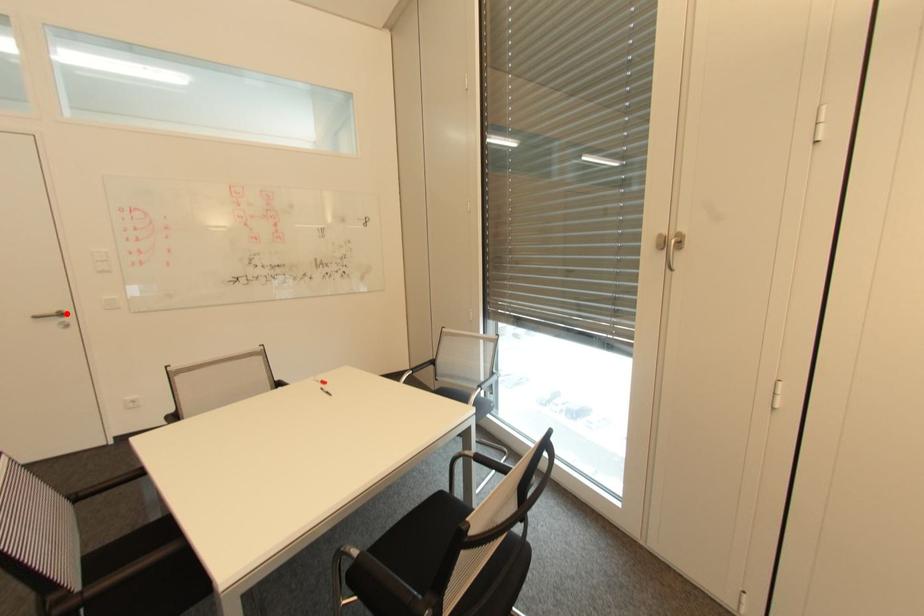
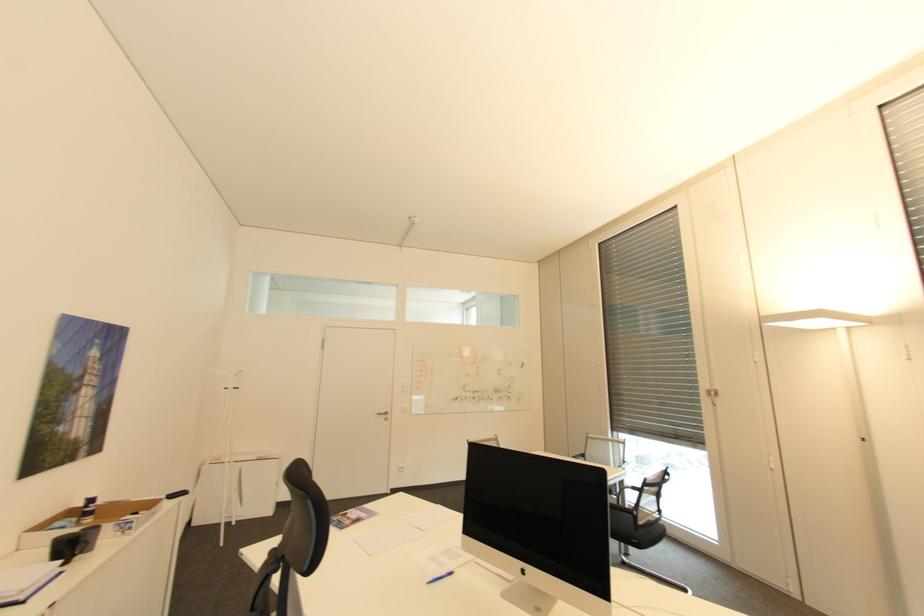
Question: A red point is marked in image1. In image2, is the corresponding 3D point closer to the camera or farther? Reply with the corresponding letter.

Choices:
 (A) The corresponding 3D point is closer.
 (B) The corresponding 3D point is farther.

Answer: (B)